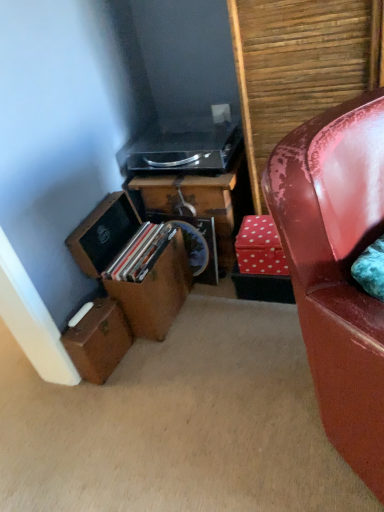
Question: In the image, is wooden box at lower left, the first box in the top-to-bottom sequence, positioned in front of or behind red polka dot cardboard box at center?

Choices:
 (A) behind
 (B) front

Answer: (B)

Question: Is wooden box at lower left, the second box positioned from the bottom, taller or shorter than red polka dot cardboard box at center?

Choices:
 (A) tall
 (B) short

Answer: (A)

Question: Which object is positioned farthest from the wooden box at lower left, the second box positioned from the bottom?

Choices:
 (A) wooden desk at center
 (B) black plastic stereo at upper center
 (C) shiny red leather chair at right
 (D) brown leather suitcase at lower left, placed as the first box when sorted from bottom to top
 (E) red polka dot cardboard box at center

Answer: (C)

Question: Which of these objects is positioned farthest from the wooden desk at center?

Choices:
 (A) shiny red leather chair at right
 (B) red polka dot cardboard box at center
 (C) black plastic stereo at upper center
 (D) wooden box at lower left, the first box in the top-to-bottom sequence
 (E) brown leather suitcase at lower left, acting as the second box starting from the top

Answer: (A)